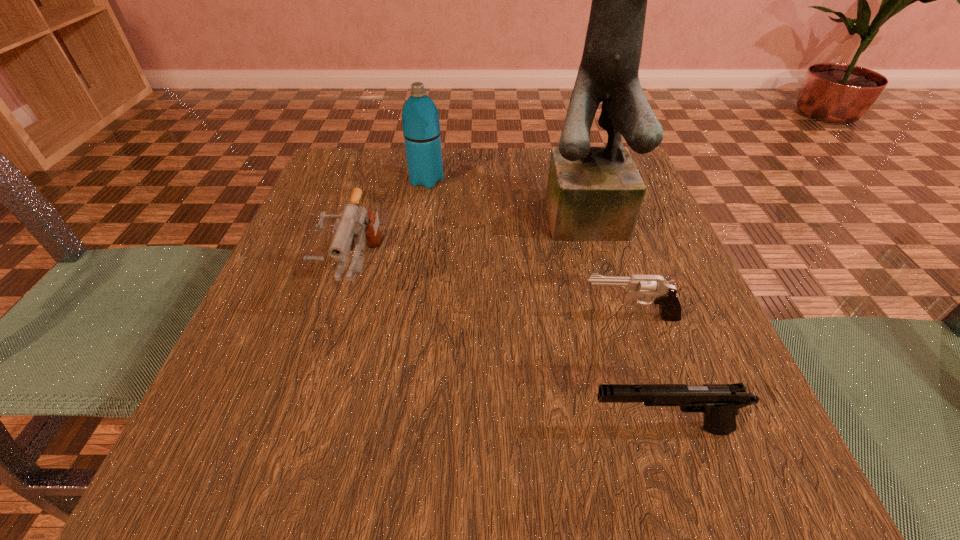
Identify the location of the tallest object. The image size is (960, 540). (593, 193).

I want to click on thermos bottle, so click(x=421, y=128).

Where is `the tallest gun`? the tallest gun is located at coordinates (354, 221).

Find the location of a particular element. the leftmost gun is located at coordinates (354, 221).

Identify the location of the nearest gun. (719, 402).

Where is `vacant space situated on the face of the sculpture`? vacant space situated on the face of the sculpture is located at coordinates (648, 377).

Locate an element on the screen. free spot located 0.060m on the right of the fourth shortest object is located at coordinates (470, 180).

The width and height of the screenshot is (960, 540). In order to click on vacant area situated 0.240m at the barrel end of the third tallest object in this screenshot , I will do `click(300, 465)`.

You are a GUI agent. You are given a task and a screenshot of the screen. Output one action in this format:
    pyautogui.click(x=<x>, y=<y>)
    Task: Click on the free spot located 0.180m at the aiming end of the nearest object
    This screenshot has height=540, width=960.
    Given the screenshot: What is the action you would take?
    pyautogui.click(x=450, y=429)

Locate an element on the screen. The image size is (960, 540). free space located 0.120m at the aiming end of the nearest object is located at coordinates (496, 429).